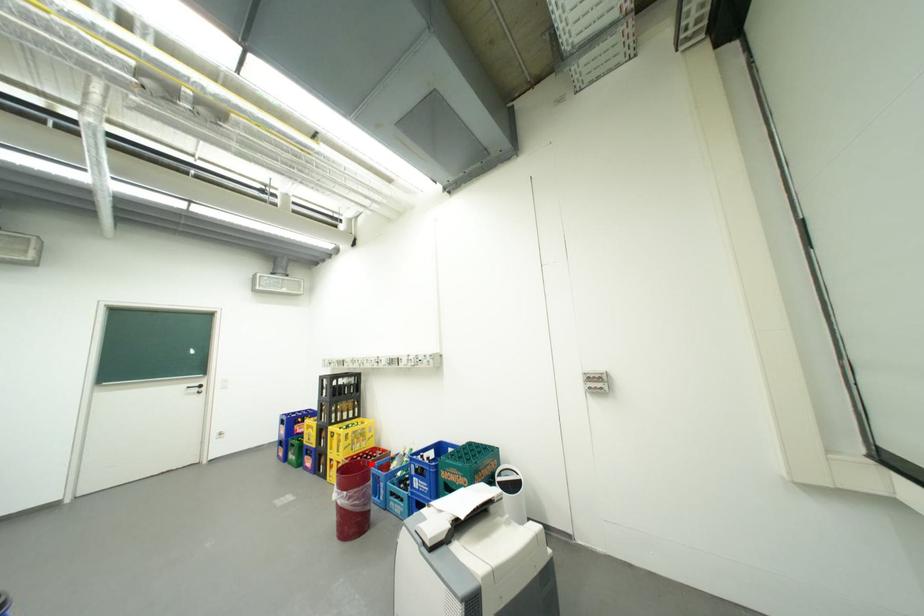
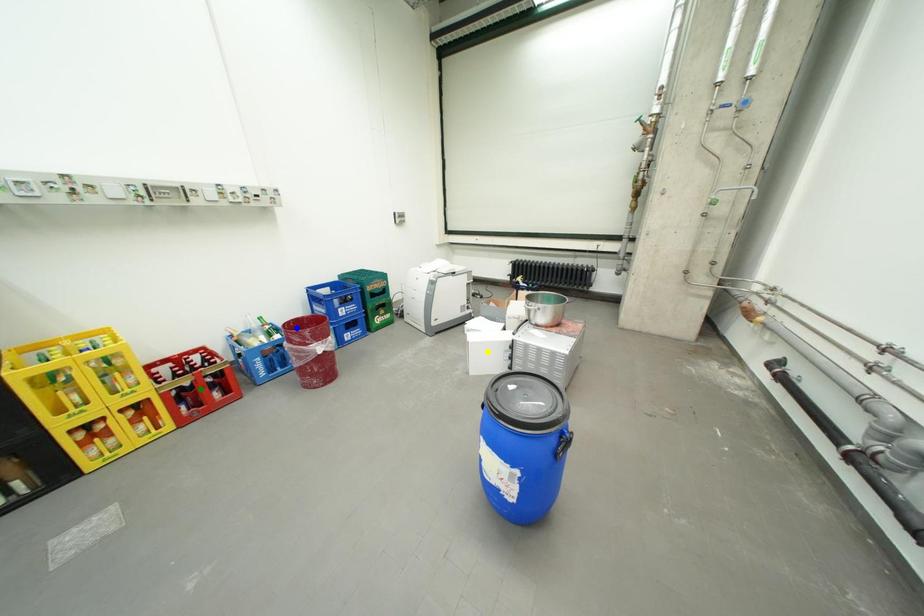
Question: I am providing you with two images of the same scene from different viewpoints. A red point is marked on the first image. You are given multiple points on the second image. In image 2, which mark is for the same physical point as the one in image 1?

Choices:
 (A) yellow point
 (B) green point
 (C) blue point

Answer: (C)